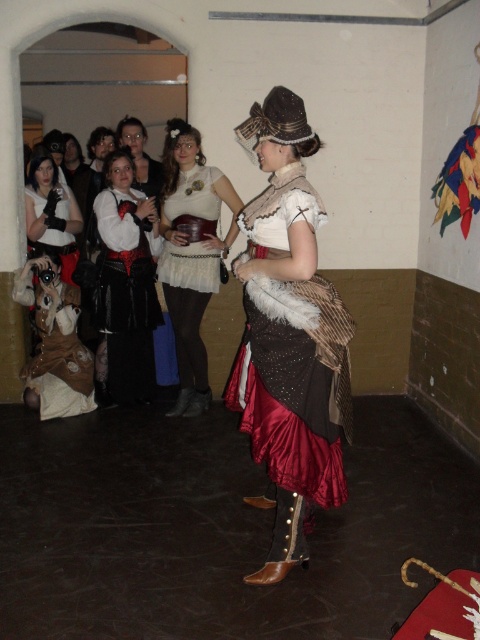
You are a photographer at the event and want to capture both the brown leather vest at lower left and the matte black gloves at left in a single shot. Which object should you focus on first to ensure both are in sharp focus?

The brown leather vest at lower left is closer to the viewer than the matte black gloves at left. To ensure both are in sharp focus, focus on the brown leather vest at lower left first, as it is the closer object.

You are a costume designer trying to adjust the placement of the brown leather vest at lower left and the matte black gloves at left for a more cohesive look. Given their current distance apart, can you bring them closer than 60 centimeters without overlapping?

The brown leather vest at lower left and matte black gloves at left are currently 64.01 centimeters apart. To bring them closer than 60 centimeters, you would need to reduce the distance by at least 4.01 centimeters. This adjustment is possible without overlapping as long as the items remain distinct and separated by some space.

You are a photographer at the event and need to adjust your camera focus. Which object, the brown leather vest at lower left or the matte black gloves at left, is positioned lower in the image?

The brown leather vest at lower left is positioned lower than the matte black gloves at left.